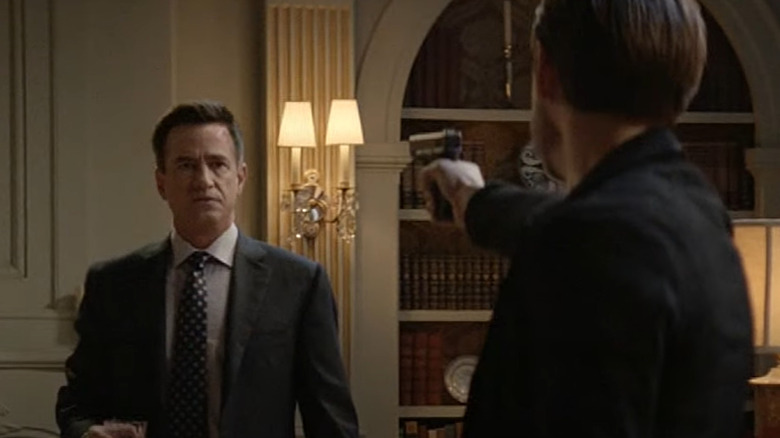
Find the location of a particular element. library area is located at coordinates (452, 314).